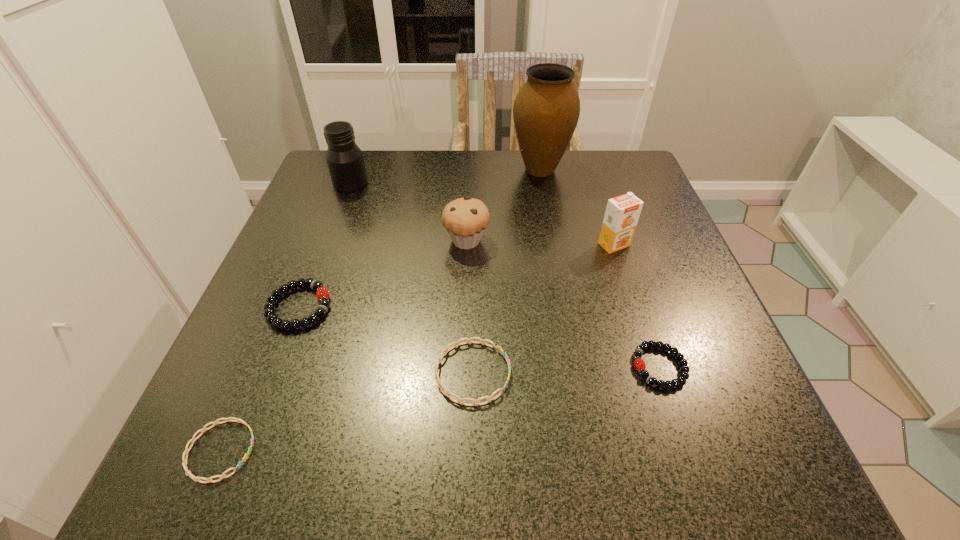
Find the location of `vacant region at the far edge of the desktop`. vacant region at the far edge of the desktop is located at coordinates (498, 158).

You are a GUI agent. You are given a task and a screenshot of the screen. Output one action in this format:
    pyautogui.click(x=<x>, y=<y>)
    Task: Click on the vacant area at the near edge
    This screenshot has width=960, height=540.
    Given the screenshot: What is the action you would take?
    pyautogui.click(x=352, y=486)

At what (x,y) coordinates should I click in order to perform the action: click on vacant region at the left edge. Please return your answer as a coordinate pair (x, y). The height and width of the screenshot is (540, 960). Looking at the image, I should click on (329, 332).

In the image, there is a desktop. Where is `vacant space at the right edge`? This screenshot has height=540, width=960. vacant space at the right edge is located at coordinates (753, 406).

Locate an element on the screen. The height and width of the screenshot is (540, 960). vacant space at the far left corner is located at coordinates coord(334,192).

The image size is (960, 540). What are the coordinates of `blank area at the near left corner` in the screenshot? It's located at (241, 428).

At what (x,y) coordinates should I click in order to perform the action: click on vacant space at the near right corner of the desktop. Please return your answer as a coordinate pair (x, y). Image resolution: width=960 pixels, height=540 pixels. Looking at the image, I should click on (756, 444).

Identify the location of free space between the bigger blue bracelet and the nearer black bracelet. (566, 369).

Identify the location of vacant point located between the smaller black bracelet and the bigger blue bracelet. This screenshot has height=540, width=960. (566, 369).

The width and height of the screenshot is (960, 540). What are the coordinates of `blank region between the muffin and the second tallest object` in the screenshot? It's located at (409, 212).